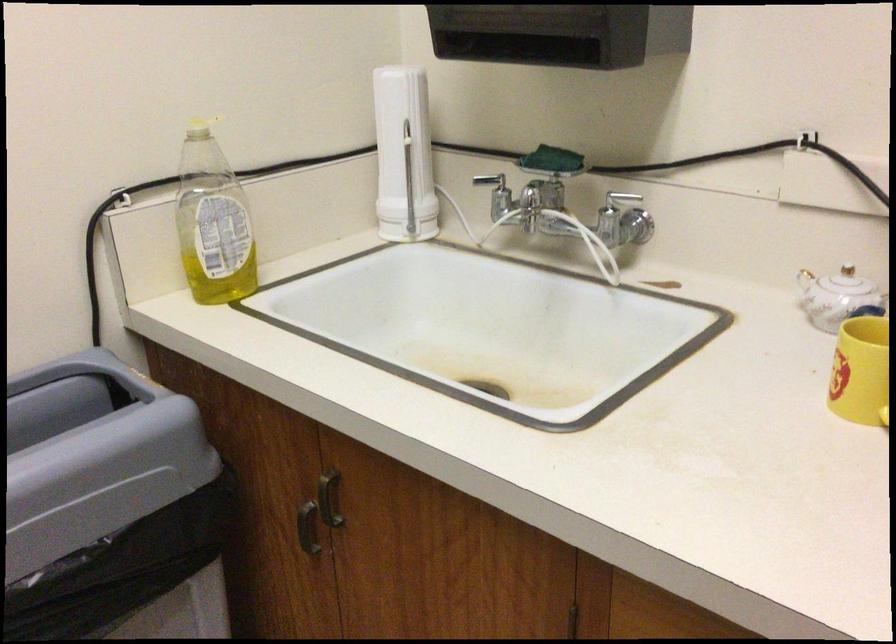
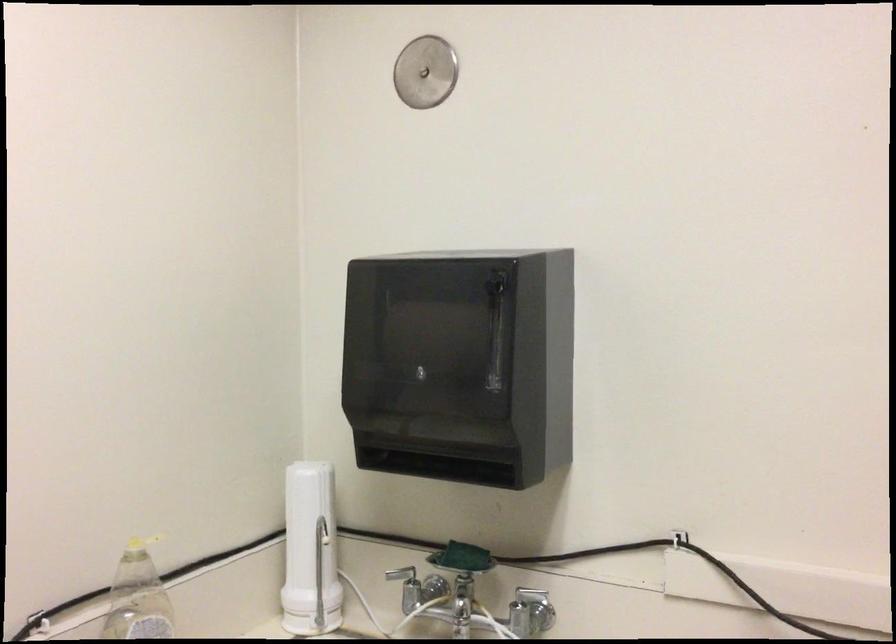
Question: The first image is from the beginning of the video and the second image is from the end. How did the camera likely rotate when shooting the video?

Choices:
 (A) Left
 (B) Right
 (C) Up
 (D) Down

Answer: (C)